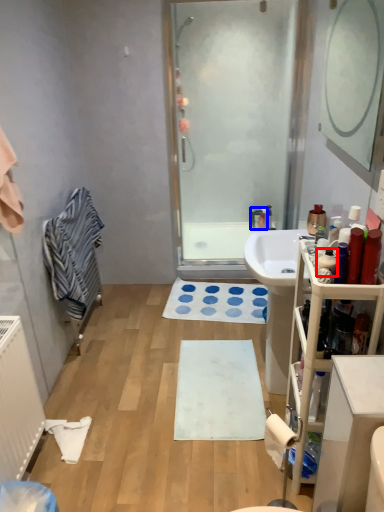
Question: Among these objects, which one is nearest to the camera, toiletry (highlighted by a red box) or faucet (highlighted by a blue box)?

Choices:
 (A) toiletry
 (B) faucet

Answer: (A)